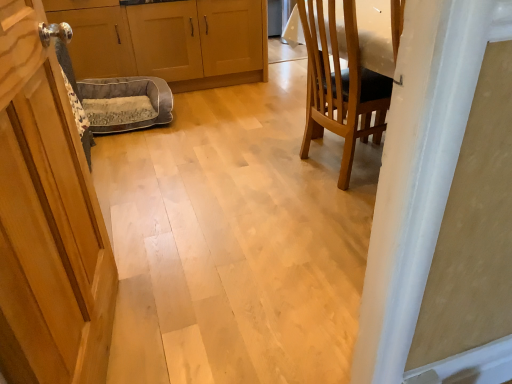
Locate an element on the screen. The image size is (512, 384). vacant area that is in front of gray fabric dog bed at center is located at coordinates (141, 147).